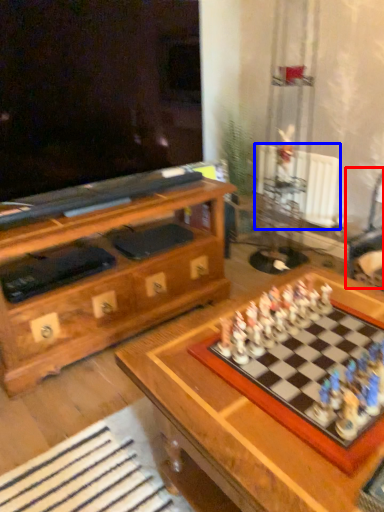
Question: Which object is further to the camera taking this photo, swivel chair (highlighted by a red box) or radiator (highlighted by a blue box)?

Choices:
 (A) swivel chair
 (B) radiator

Answer: (B)